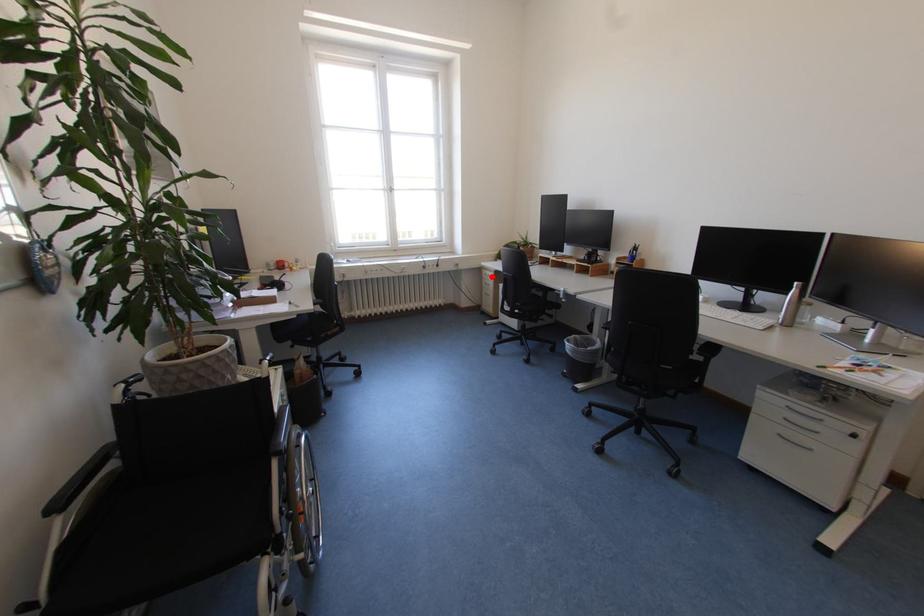
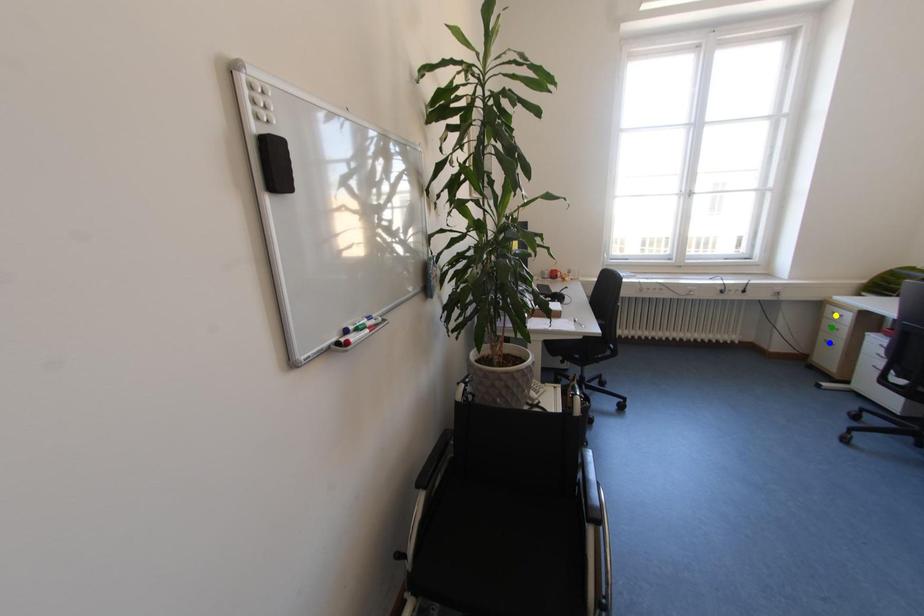
Question: I am providing you with two images of the same scene from different viewpoints. A red point is marked on the first image. You are given multiple points on the second image. Can you choose the point in image 2 that corresponds to the point in image 1?

Choices:
 (A) green point
 (B) blue point
 (C) yellow point

Answer: (C)